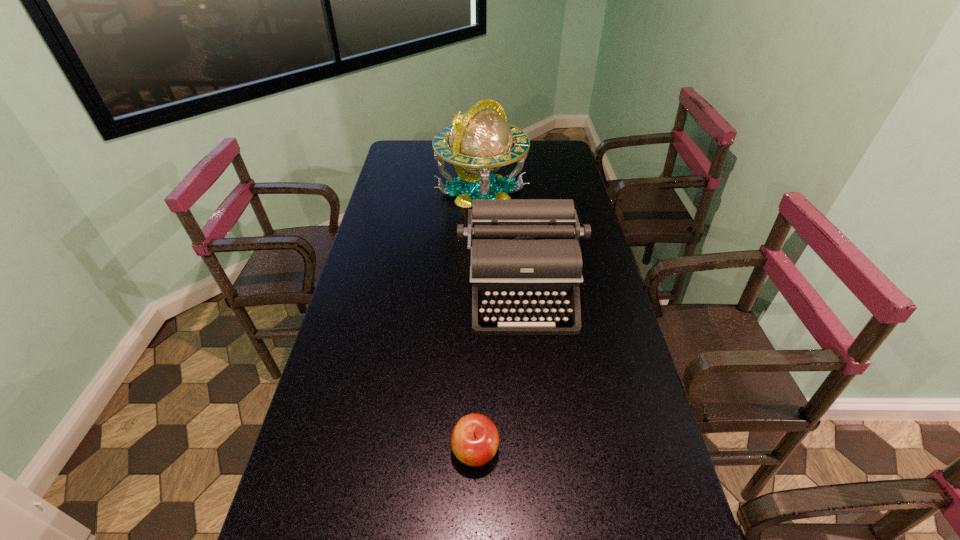
I want to click on the farthest object, so click(x=480, y=140).

Locate an element on the screen. Image resolution: width=960 pixels, height=540 pixels. globe is located at coordinates (480, 140).

The height and width of the screenshot is (540, 960). I want to click on the second tallest object, so click(x=523, y=252).

Find the location of a particular element. the second nearest object is located at coordinates (523, 252).

Where is `apple`? The height and width of the screenshot is (540, 960). apple is located at coordinates (475, 439).

This screenshot has width=960, height=540. In order to click on the nearest object in this screenshot , I will do `click(475, 439)`.

You are a GUI agent. You are given a task and a screenshot of the screen. Output one action in this format:
    pyautogui.click(x=<x>, y=<y>)
    Task: Click on the free space located on the right of the globe
    This screenshot has width=960, height=540.
    Given the screenshot: What is the action you would take?
    pyautogui.click(x=557, y=191)

Identify the location of blank area located 0.170m on the typing side of the second tallest object. (532, 386).

You are a GUI agent. You are given a task and a screenshot of the screen. Output one action in this format:
    pyautogui.click(x=<x>, y=<y>)
    Task: Click on the free space located 0.090m on the right of the shortest object
    The height and width of the screenshot is (540, 960).
    Given the screenshot: What is the action you would take?
    pyautogui.click(x=538, y=450)

You are a GUI agent. You are given a task and a screenshot of the screen. Output one action in this format:
    pyautogui.click(x=<x>, y=<y>)
    Task: Click on the object that is positioned at the right edge
    
    Given the screenshot: What is the action you would take?
    pyautogui.click(x=523, y=252)